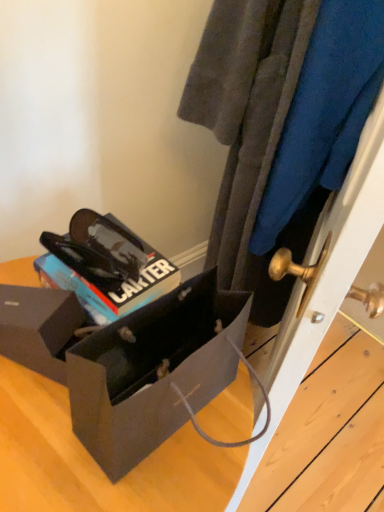
Question: Does glossy black sunglasses at center have a lesser width compared to matte black box at lower left, arranged as the 1th box when viewed from the front?

Choices:
 (A) no
 (B) yes

Answer: (B)

Question: Is glossy black sunglasses at center positioned behind matte black box at lower left, arranged as the 1th box when viewed from the front?

Choices:
 (A) no
 (B) yes

Answer: (B)

Question: From the image's perspective, is glossy black sunglasses at center over matte black box at lower left, the second box when ordered from back to front?

Choices:
 (A) yes
 (B) no

Answer: (A)

Question: Is glossy black sunglasses at center positioned far away from matte black box at lower left, the second box when ordered from back to front?

Choices:
 (A) yes
 (B) no

Answer: (B)

Question: Can matte black box at lower left, the second box when ordered from back to front, be found inside glossy black sunglasses at center?

Choices:
 (A) yes
 (B) no

Answer: (B)

Question: Can you confirm if glossy black sunglasses at center is wider than matte black box at lower left, arranged as the 1th box when viewed from the front?

Choices:
 (A) yes
 (B) no

Answer: (B)

Question: Could you tell me if matte black box at lower left, arranged as the 1th box when viewed from the front, is turned towards glossy black sunglasses at center?

Choices:
 (A) no
 (B) yes

Answer: (A)

Question: Considering the relative sizes of matte black box at lower left, arranged as the 1th box when viewed from the front, and glossy black sunglasses at center in the image provided, is matte black box at lower left, arranged as the 1th box when viewed from the front, taller than glossy black sunglasses at center?

Choices:
 (A) yes
 (B) no

Answer: (A)

Question: Is the depth of matte black box at lower left, arranged as the 1th box when viewed from the front, greater than that of glossy black sunglasses at center?

Choices:
 (A) no
 (B) yes

Answer: (A)

Question: Would you consider matte black box at lower left, the second box when ordered from back to front, to be distant from glossy black sunglasses at center?

Choices:
 (A) no
 (B) yes

Answer: (A)

Question: Can you confirm if matte black box at lower left, arranged as the 1th box when viewed from the front, is positioned to the right of glossy black sunglasses at center?

Choices:
 (A) yes
 (B) no

Answer: (B)

Question: Would you say glossy black sunglasses at center is part of matte black box at lower left, arranged as the 1th box when viewed from the front,'s contents?

Choices:
 (A) no
 (B) yes

Answer: (A)

Question: Considering the relative sizes of velvety blue sweater at center and glossy black sunglasses at center in the image provided, is velvety blue sweater at center wider than glossy black sunglasses at center?

Choices:
 (A) no
 (B) yes

Answer: (B)